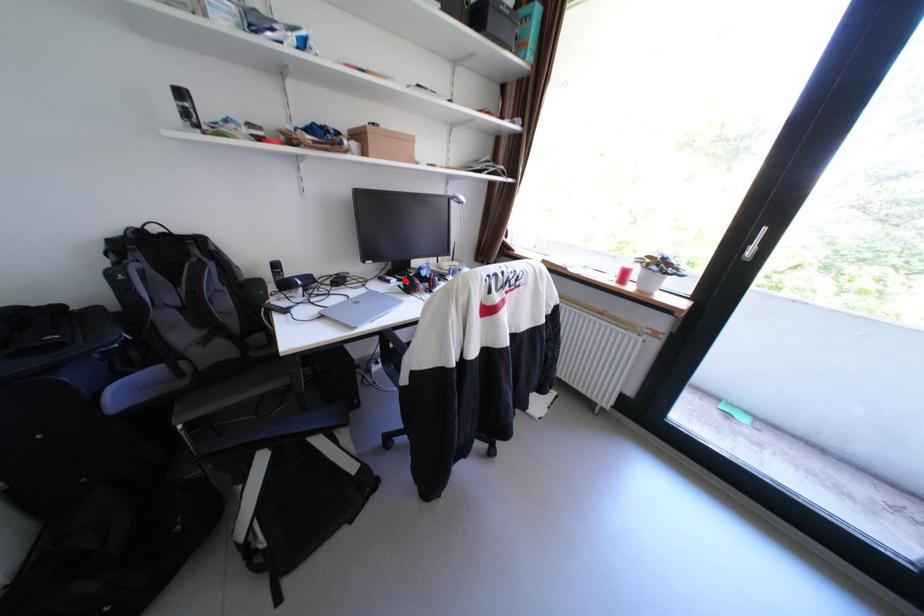
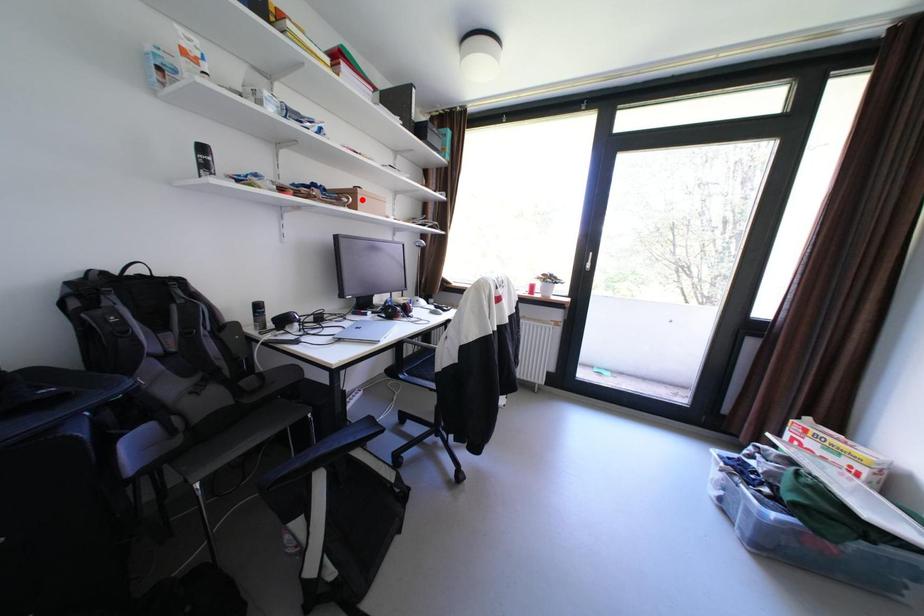
I am providing you with two images of the same scene from different viewpoints. A red point is marked on the first image and another point is marked on the second image. Are the points marked in image1 and image2 representing the same 3D position?

No